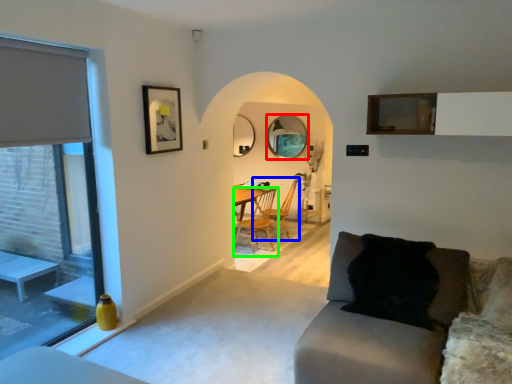
Question: Which object is positioned farthest from mirror (highlighted by a red box)? Select from chair (highlighted by a blue box) and chair (highlighted by a green box).

Choices:
 (A) chair
 (B) chair

Answer: (B)